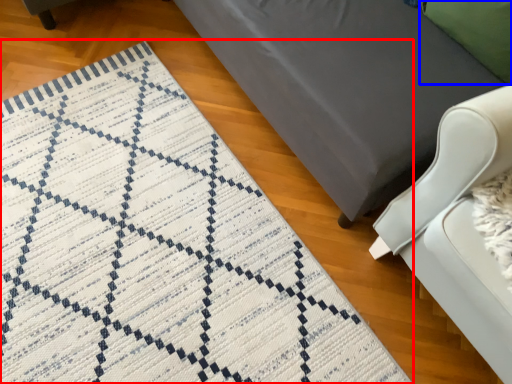
Question: Which of the following is the closest to the observer, mat (highlighted by a red box) or pillow (highlighted by a blue box)?

Choices:
 (A) mat
 (B) pillow

Answer: (A)